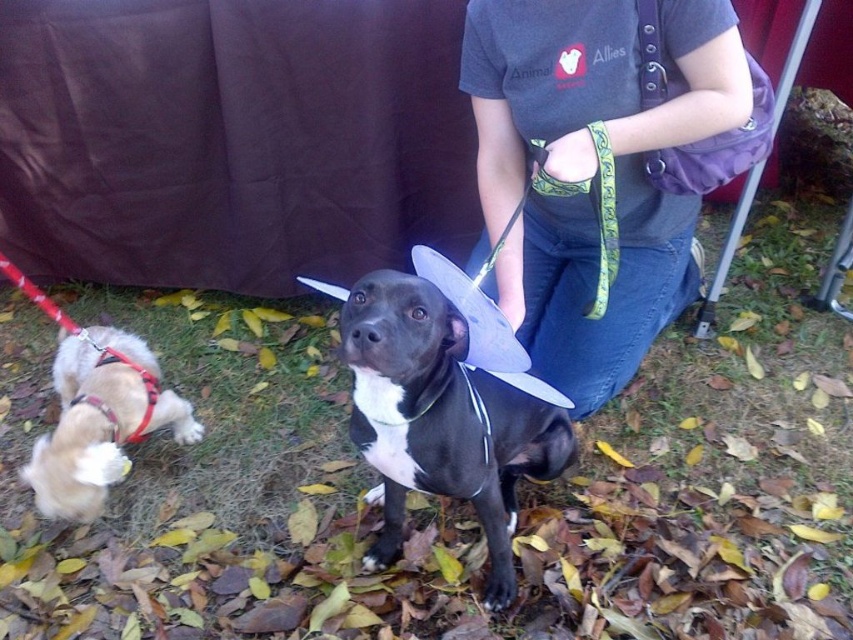
Question: Is black matte dog at center to the left of red nylon leash at lower left from the viewer's perspective?

Choices:
 (A) yes
 (B) no

Answer: (B)

Question: Among these objects, which one is farthest from the camera?

Choices:
 (A) denim jeans at center
 (B) black matte dog at center

Answer: (A)

Question: Does black matte dog at center appear on the left side of light brown fur at lower left?

Choices:
 (A) yes
 (B) no

Answer: (B)

Question: Can you confirm if denim jeans at center is bigger than red nylon leash at lower left?

Choices:
 (A) yes
 (B) no

Answer: (A)

Question: Which is farther from the denim jeans at center?

Choices:
 (A) black matte dog at center
 (B) light brown fur at lower left
 (C) red nylon leash at lower left

Answer: (C)

Question: Which of the following is the farthest from the observer?

Choices:
 (A) (96, 396)
 (B) (103, 349)
 (C) (741, 112)
 (D) (357, 442)

Answer: (B)